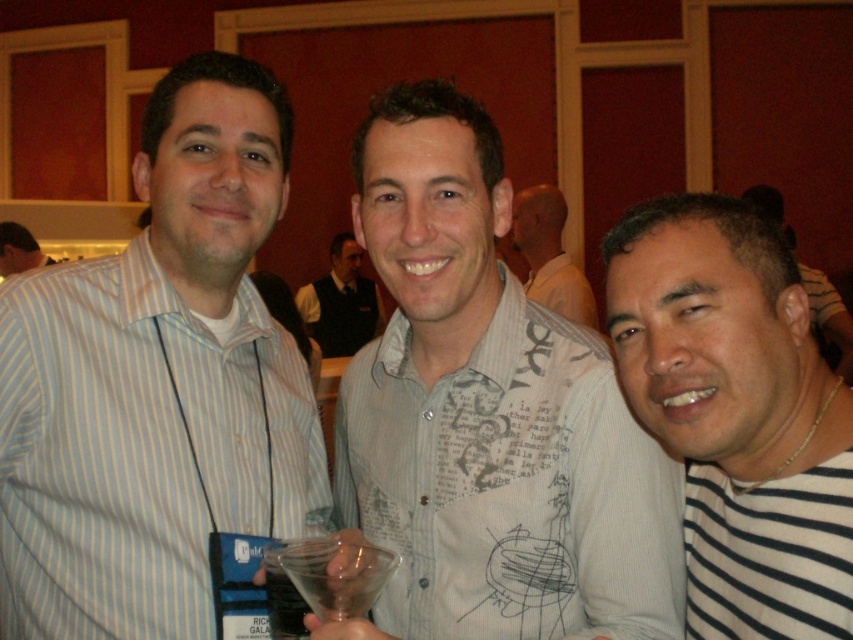
Question: Can you confirm if black striped shirt at right is smaller than white printed shirt at center?

Choices:
 (A) no
 (B) yes

Answer: (B)

Question: Is light blue striped shirt at left bigger than black striped shirt at right?

Choices:
 (A) yes
 (B) no

Answer: (A)

Question: Which point appears farthest from the camera in this image?

Choices:
 (A) (200, 225)
 (B) (584, 292)
 (C) (838, 328)
 (D) (267, 566)

Answer: (C)

Question: Which object is the closest to the light blue striped shirt at left?

Choices:
 (A) light gray printed shirt at center
 (B) white printed shirt at center
 (C) clear plastic cup at center

Answer: (A)

Question: Among these objects, which one is nearest to the camera?

Choices:
 (A) white striped shirt at right
 (B) black striped shirt at right

Answer: (B)

Question: Considering the relative positions of black striped shirt at right and light blue striped shirt at center in the image provided, where is black striped shirt at right located with respect to light blue striped shirt at center?

Choices:
 (A) above
 (B) below

Answer: (B)